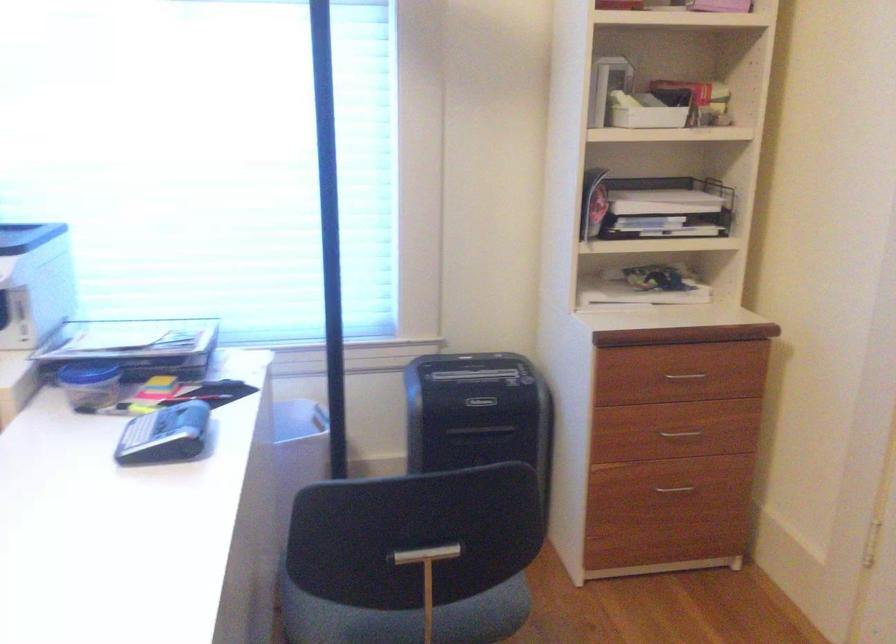
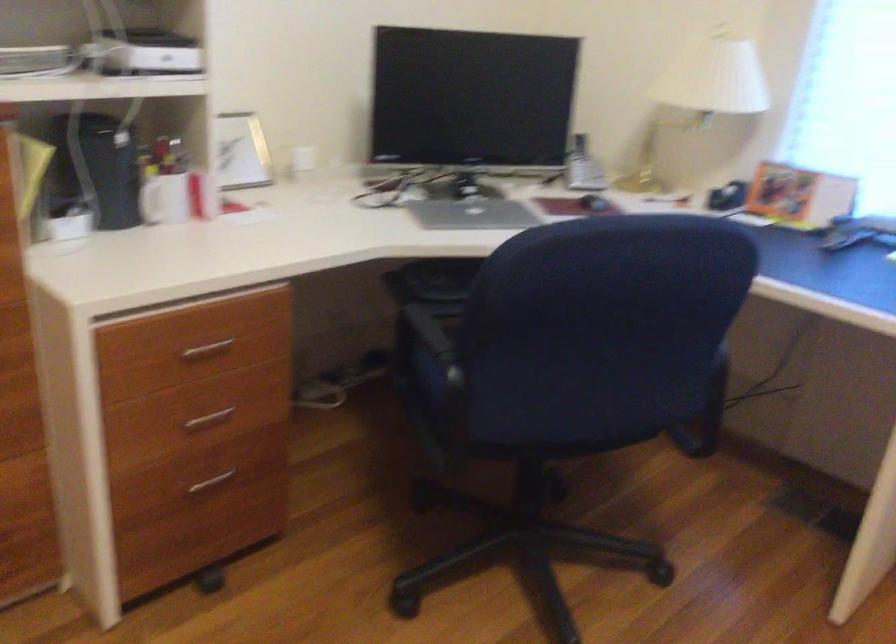
Question: The camera is either moving clockwise (left) or counter-clockwise (right) around the object. The first image is from the beginning of the video and the second image is from the end. Is the camera moving left or right when shooting the video?

Choices:
 (A) Left
 (B) Right

Answer: (B)